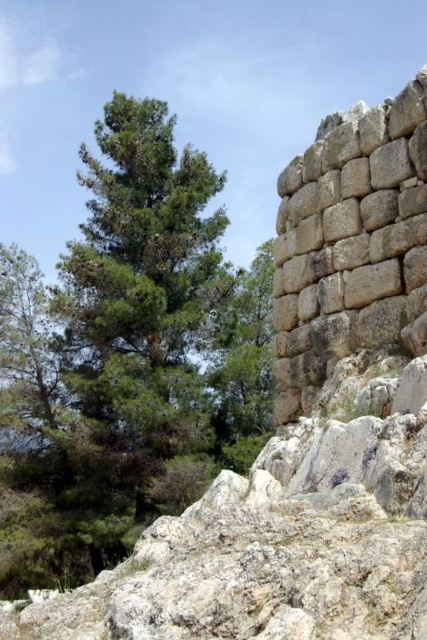
In the scene shown: Which is below, green leafy tree at upper left or natural stone wall at right?

Positioned lower is green leafy tree at upper left.

From the picture: Is green leafy tree at upper left further to camera compared to natural stone wall at right?

Yes, it is.

Measure the distance between point (254, 307) and camera.

Point (254, 307) is 116.38 meters from camera.

Identify the location of green leafy tree at upper left. The image size is (427, 640). (126, 358).